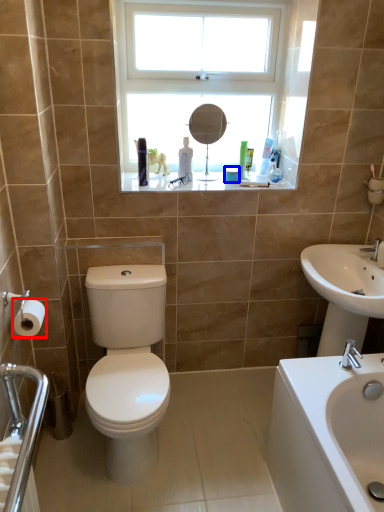
Question: Among these objects, which one is nearest to the camera, toilet paper (highlighted by a red box) or toiletry (highlighted by a blue box)?

Choices:
 (A) toilet paper
 (B) toiletry

Answer: (A)